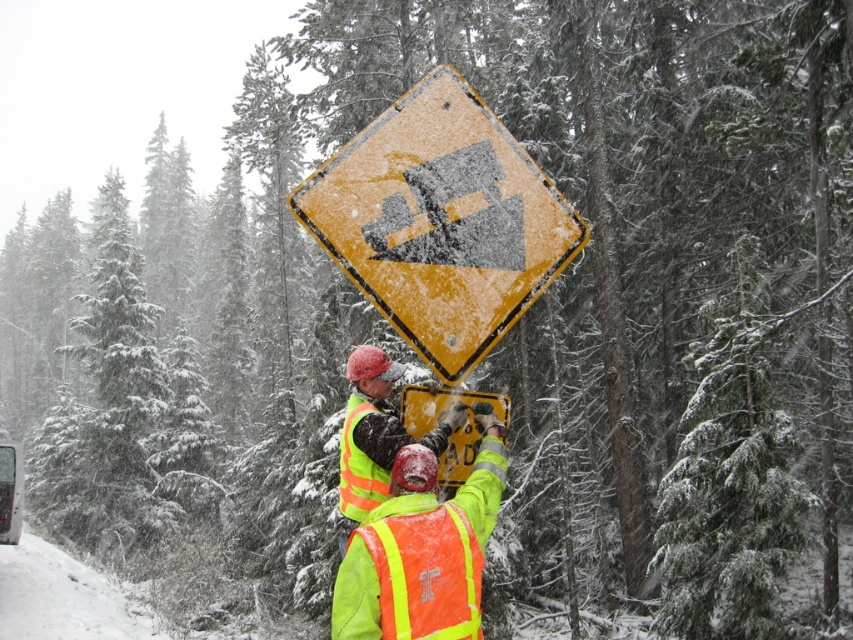
Question: Which of the following is the farthest from the observer?

Choices:
 (A) high-visibility reflective safety vest at center
 (B) high-visibility reflective vest at center
 (C) yellow reflective diamond at center

Answer: (C)

Question: Which of the following is the farthest from the observer?

Choices:
 (A) (474, 493)
 (B) (451, 236)
 (C) (405, 515)
 (D) (369, 435)

Answer: (D)

Question: Is high-visibility reflective safety vest at center thinner than high visibility yellow-green safety vest at center?

Choices:
 (A) yes
 (B) no

Answer: (A)

Question: From the image, what is the correct spatial relationship of high-visibility reflective vest at center in relation to high-visibility reflective safety vest at center?

Choices:
 (A) right
 (B) left

Answer: (B)

Question: Which point is farther from the camera taking this photo?

Choices:
 (A) (413, 588)
 (B) (450, 212)
 (C) (399, 365)

Answer: (C)

Question: Is yellow reflective diamond at center above high visibility yellow-green safety vest at center?

Choices:
 (A) no
 (B) yes

Answer: (B)